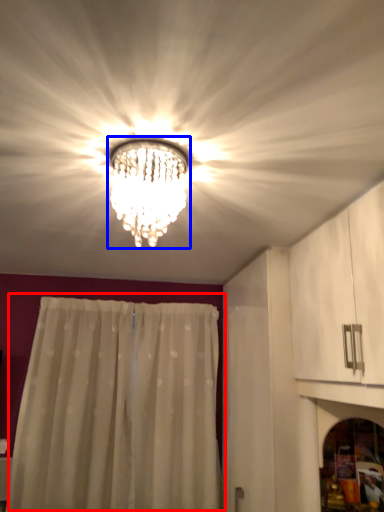
Question: Which of the following is the farthest to the observer, curtain (highlighted by a red box) or lamp (highlighted by a blue box)?

Choices:
 (A) curtain
 (B) lamp

Answer: (A)